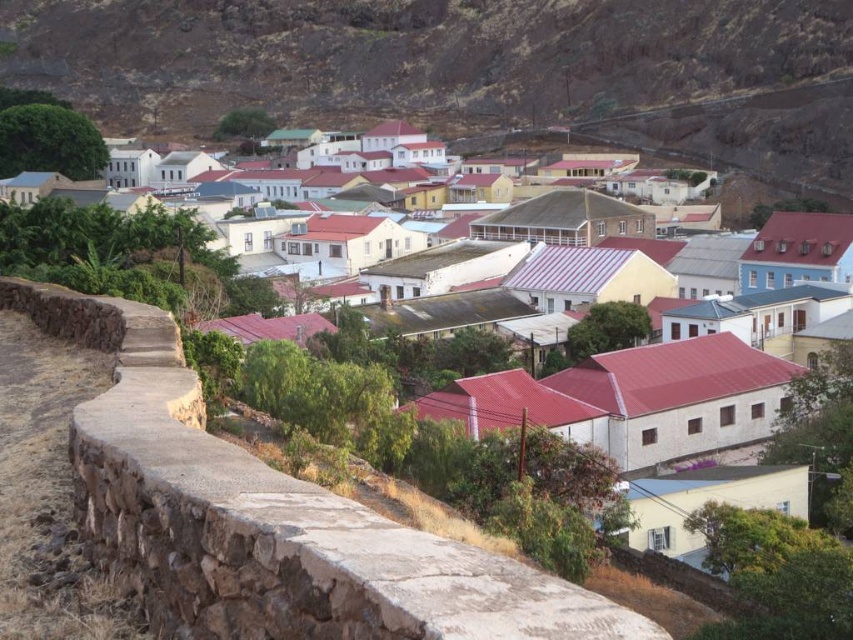
Does white stone houses at center lie in front of brown stone wall at lower left?

No, white stone houses at center is behind brown stone wall at lower left.

What do you see at coordinates (473, 68) in the screenshot? The height and width of the screenshot is (640, 853). I see `white stone houses at center` at bounding box center [473, 68].

Find the location of `white stone houses at center`. white stone houses at center is located at coordinates (473, 68).

Does point (90, 404) come in front of point (706, 308)?

Yes, point (90, 404) is in front of point (706, 308).

Which is in front, point (381, 580) or point (84, 330)?

Point (381, 580) is in front.

This screenshot has width=853, height=640. I want to click on brown stone ledge at lower left, so click(265, 518).

Is white stone houses at center thinner than brown stone ledge at lower left?

Incorrect, white stone houses at center's width is not less than brown stone ledge at lower left's.

Which is in front, point (809, 64) or point (380, 627)?

Point (380, 627) is in front.

At what (x,y) coordinates should I click in order to perform the action: click on white stone houses at center. Please return your answer as a coordinate pair (x, y). This screenshot has height=640, width=853. Looking at the image, I should click on (473, 68).